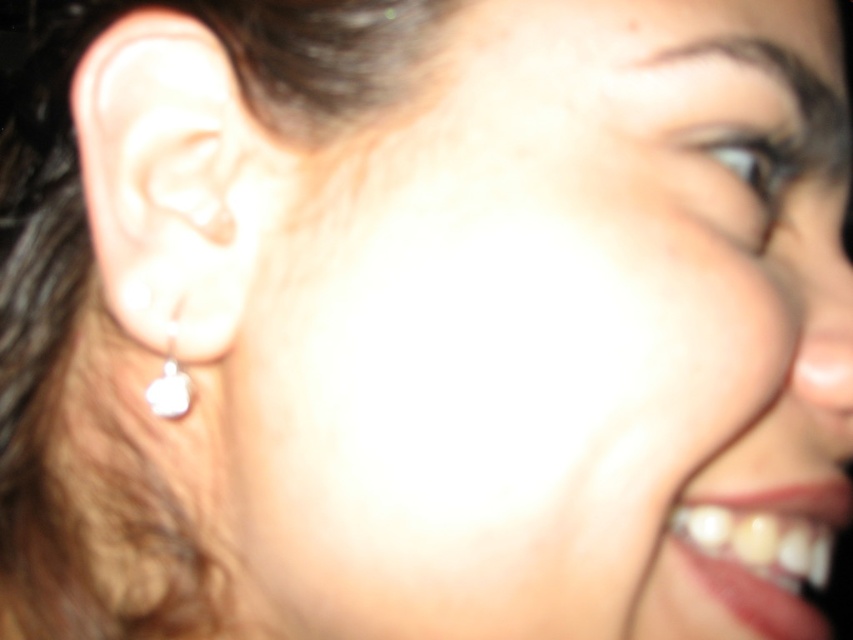
Question: Which of the following is the farthest from the observer?

Choices:
 (A) pearl earring at left
 (B) silver metallic earring at left

Answer: (B)

Question: Does pearl earring at left have a greater width compared to silver metallic earring at left?

Choices:
 (A) yes
 (B) no

Answer: (A)

Question: Does pearl earring at left appear over silver metallic earring at left?

Choices:
 (A) yes
 (B) no

Answer: (A)

Question: Does pearl earring at left appear over silver metallic earring at left?

Choices:
 (A) yes
 (B) no

Answer: (A)